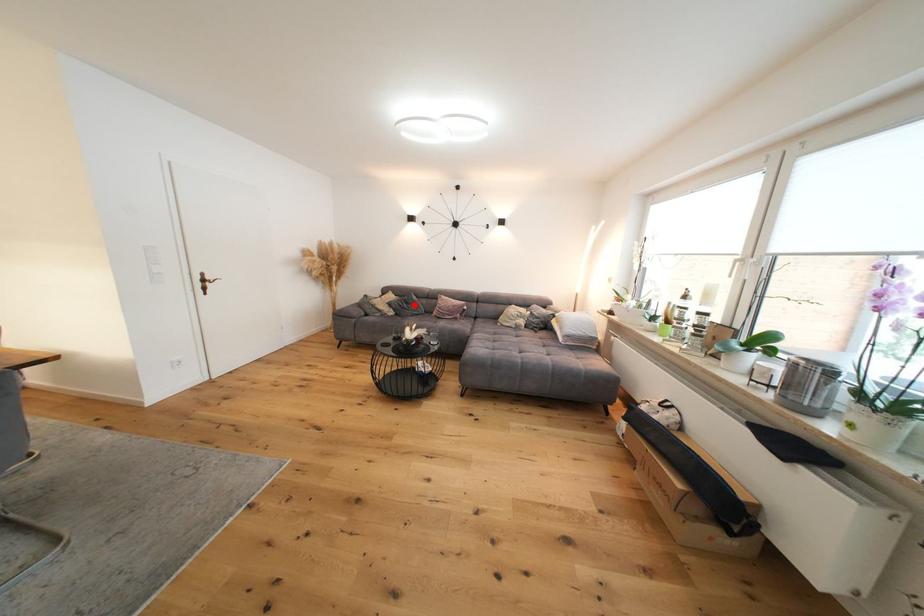
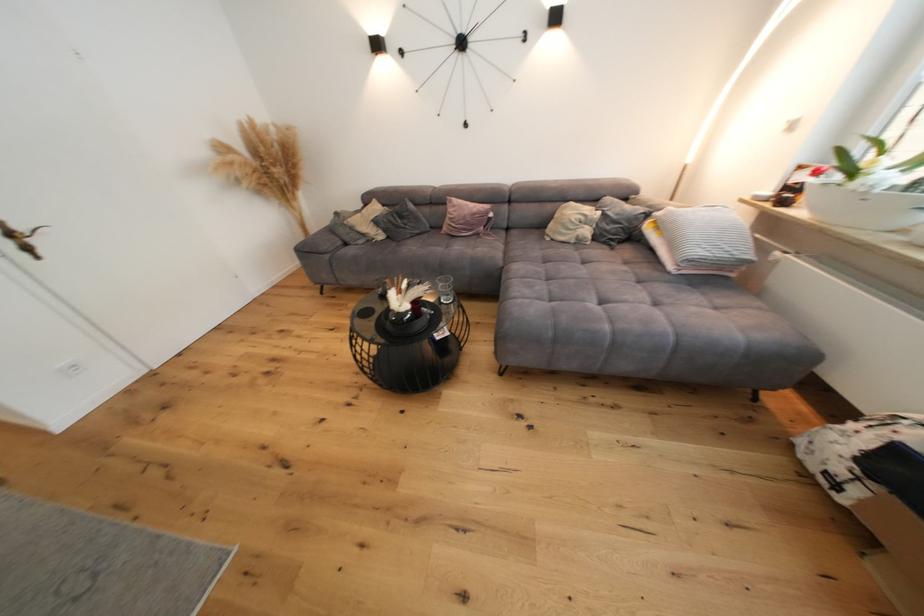
Locate, in the second image, the point that corresponds to the highlighted location in the first image.

(408, 219)